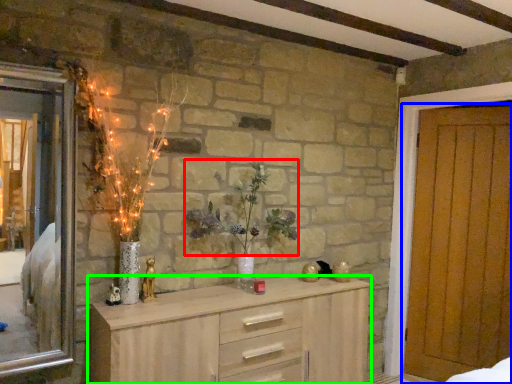
Question: Estimate the real-world distances between objects in this image. Which object is closer to floral arrangement (highlighted by a red box), door (highlighted by a blue box) or chest of drawers (highlighted by a green box)?

Choices:
 (A) door
 (B) chest of drawers

Answer: (B)